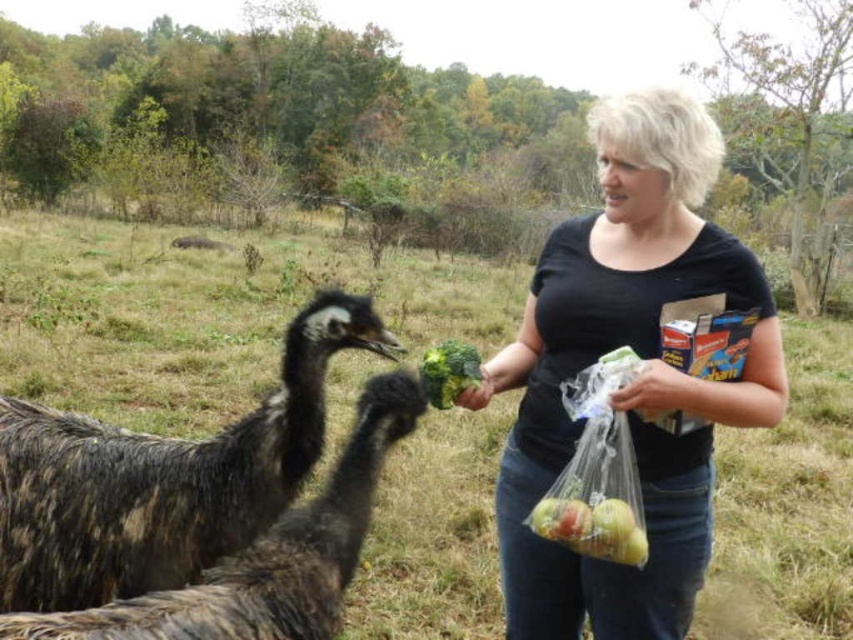
Does black cotton t-shirt at center have a lesser width compared to dark brown feathered ostrich at left?

Yes.

The height and width of the screenshot is (640, 853). Find the location of `black cotton t-shirt at center`. black cotton t-shirt at center is located at coordinates (637, 372).

Is point (433, 403) closer to viewer compared to point (550, 496)?

No, (433, 403) is further to viewer.

Between green broccoli at center and shiny yellow apples at lower center, which one is positioned higher?

Positioned higher is green broccoli at center.

This screenshot has height=640, width=853. I want to click on green broccoli at center, so click(x=448, y=371).

Can you confirm if black cotton t-shirt at center is wider than shiny yellow apples at lower center?

Indeed, black cotton t-shirt at center has a greater width compared to shiny yellow apples at lower center.

Who is positioned more to the left, black cotton t-shirt at center or shiny yellow apples at lower center?

From the viewer's perspective, shiny yellow apples at lower center appears more on the left side.

Is point (660, 106) in front of point (560, 500)?

No, it is behind (560, 500).

Identify the location of black cotton t-shirt at center. (637, 372).